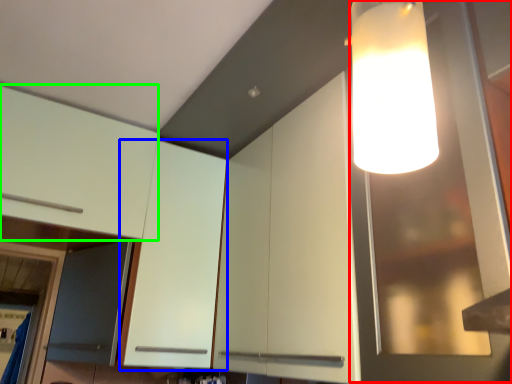
Question: Estimate the real-world distances between objects in this image. Which object is farther from glass door (highlighted by a red box), cabinetry (highlighted by a blue box) or cabinetry (highlighted by a green box)?

Choices:
 (A) cabinetry
 (B) cabinetry

Answer: (B)